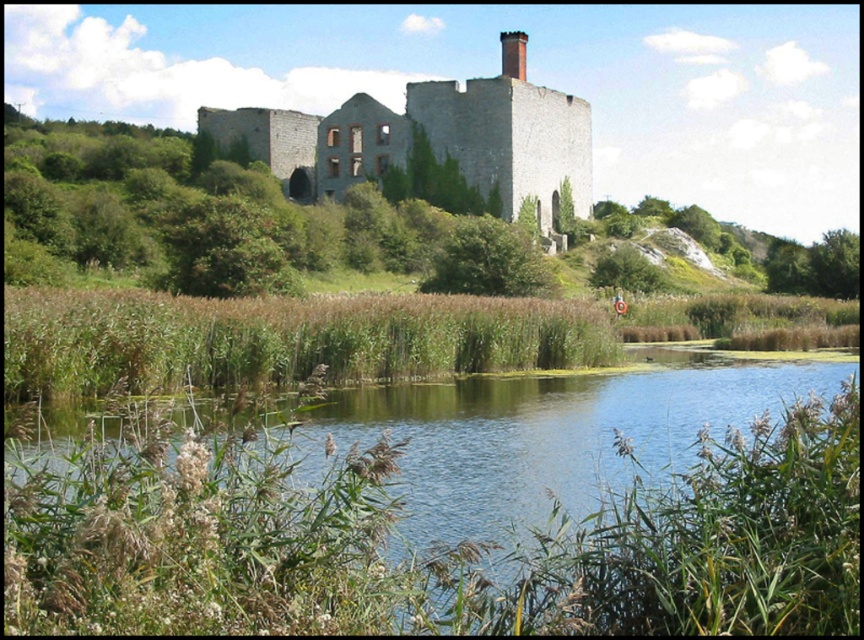
Is point (288, 481) in front of point (502, 196)?

Yes, it is.

Does green grassy river at center have a larger size compared to gray stone castle at center?

No.

Locate an element on the screen. green grassy river at center is located at coordinates (426, 547).

What are the coordinates of `green grassy river at center` in the screenshot? It's located at (426, 547).